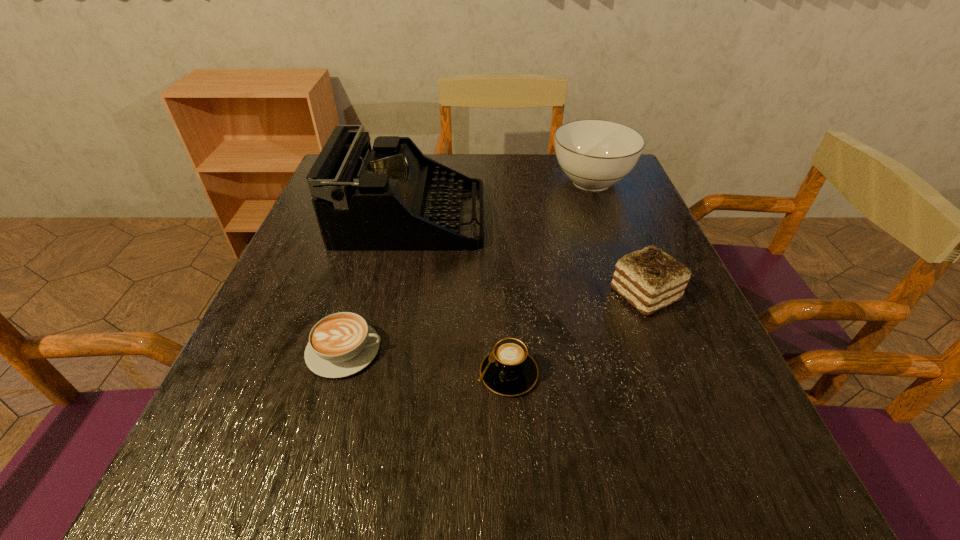
Find the location of a particular element. This screenshot has width=960, height=540. blank region between the left cappuccino and the right cappuccino is located at coordinates (x=426, y=362).

Locate an element on the screen. The image size is (960, 540). empty space between the chinaware and the fourth tallest object is located at coordinates (550, 278).

Image resolution: width=960 pixels, height=540 pixels. In order to click on unoccupied position between the second shortest object and the typewriter in this screenshot , I will do `click(460, 295)`.

Where is `free spot between the chinaware and the fourth tallest object`? The image size is (960, 540). free spot between the chinaware and the fourth tallest object is located at coordinates (550, 278).

At what (x,y) coordinates should I click in order to perform the action: click on free area in between the left cappuccino and the tallest object. Please return your answer as a coordinate pair (x, y). This screenshot has width=960, height=540. Looking at the image, I should click on (378, 284).

Find the location of `free space between the third tallest object and the right cappuccino`. free space between the third tallest object and the right cappuccino is located at coordinates (576, 334).

Select which object appears as the second closest to the typewriter. Please provide its 2D coordinates. Your answer should be formatted as a tuple, i.e. [(x, y)], where the tuple contains the x and y coordinates of a point satisfying the conditions above.

[(341, 344)]

Find the location of a particular element. Image resolution: width=960 pixels, height=540 pixels. object that stands as the fourth closest to the tallest object is located at coordinates (508, 370).

This screenshot has width=960, height=540. Find the location of `free point that satisfies the following two spatial constraints: 1. on the typing side of the typewriter; 2. on the left side of the fourth tallest object`. free point that satisfies the following two spatial constraints: 1. on the typing side of the typewriter; 2. on the left side of the fourth tallest object is located at coordinates (379, 374).

Locate an element on the screen. This screenshot has width=960, height=540. free space that satisfies the following two spatial constraints: 1. on the side of the shorter cappuccino with the handle; 2. on the left side of the taller cappuccino is located at coordinates (338, 374).